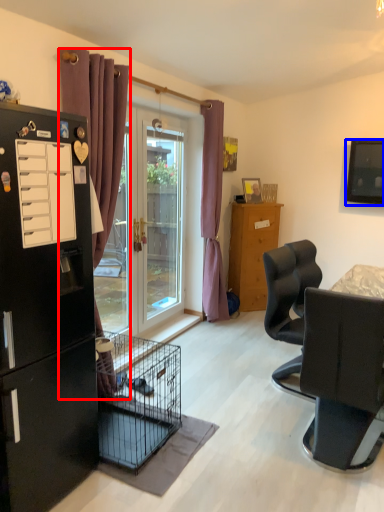
Question: Which of the following is the closest to the observer, curtain (highlighted by a red box) or television (highlighted by a blue box)?

Choices:
 (A) curtain
 (B) television

Answer: (A)